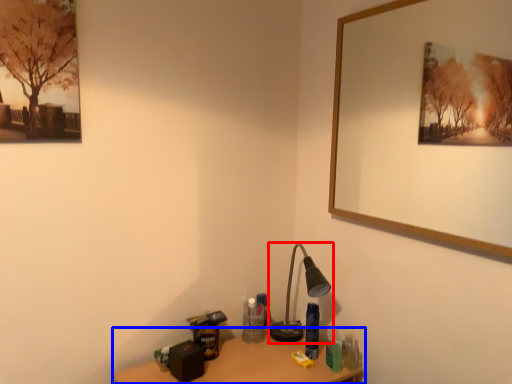
Question: Which of the following is the closest to the observer, lamp (highlighted by a red box) or table (highlighted by a blue box)?

Choices:
 (A) lamp
 (B) table

Answer: (B)